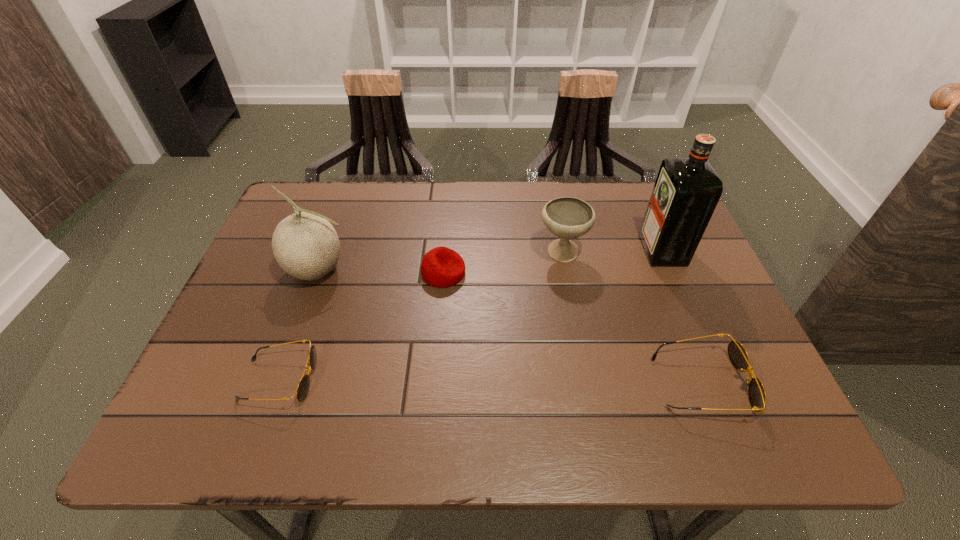
Locate an element on the screen. object that is at the near right corner is located at coordinates (737, 354).

The width and height of the screenshot is (960, 540). In the image, there is a desktop. In order to click on vacant space at the far edge in this screenshot , I will do `click(602, 223)`.

Find the location of a particular element. The image size is (960, 540). free space at the far left corner is located at coordinates (315, 205).

The height and width of the screenshot is (540, 960). I want to click on vacant region at the near left corner of the desktop, so click(x=228, y=383).

At what (x,y) coordinates should I click in order to perform the action: click on vacant area that lies between the shorter sunglasses and the second tallest object. Please return your answer as a coordinate pair (x, y). The height and width of the screenshot is (540, 960). Looking at the image, I should click on (299, 325).

At what (x,y) coordinates should I click in order to perform the action: click on unoccupied area between the right sunglasses and the left sunglasses. Please return your answer as a coordinate pair (x, y). Image resolution: width=960 pixels, height=540 pixels. Looking at the image, I should click on (491, 381).

Where is `free point between the left sunglasses and the fifth shortest object`? The image size is (960, 540). free point between the left sunglasses and the fifth shortest object is located at coordinates (299, 325).

Identify the location of free space between the left sunglasses and the taller sunglasses. (491, 381).

Image resolution: width=960 pixels, height=540 pixels. Find the location of `vacant area that lies between the chalice and the beanbag`. vacant area that lies between the chalice and the beanbag is located at coordinates (503, 263).

Image resolution: width=960 pixels, height=540 pixels. Identify the location of vacant area between the third object from left to right and the second tallest object. (381, 272).